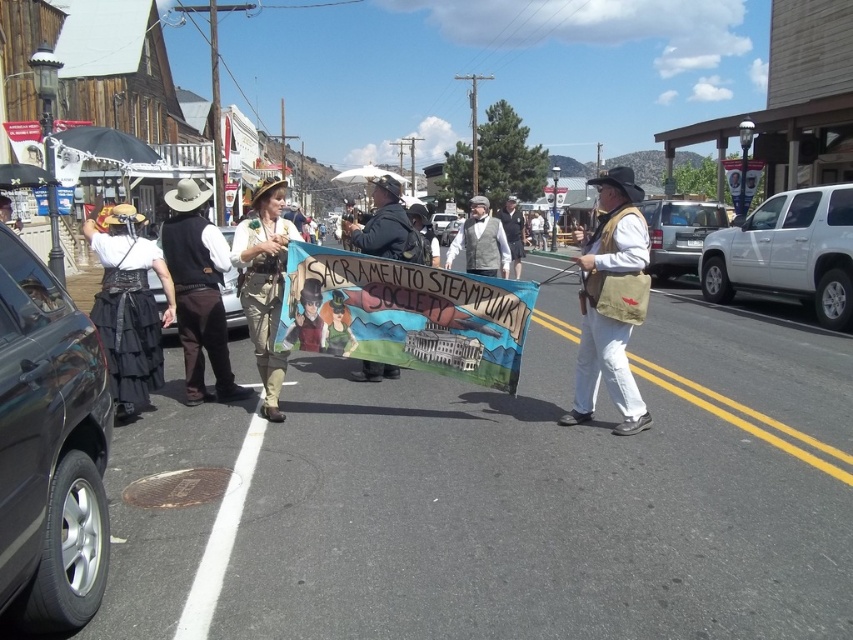
You are standing in the middle of the street at the Sacramento Steampunk Society parade. You want to read the matte black sign at center but are currently 5.83 meters away from it. Is this distance sufficient to read the text on the sign clearly?

The matte black sign at center is 5.83 meters away from viewer. This distance may be sufficient to read the text on the sign clearly, depending on the size of the text and the viewer s visual acuity. However, moving closer could provide a better view for readability.

You are standing at the point closest to the camera in the image. There are two points marked in the scene, one at point (587, 320) and another at point (515, 240). Which point should you move towards if you want to get closer to the camera?

Point (587, 320) is closer to the camera than point (515, 240). Since you are already at the point closest to the camera, you should stay at point (587, 320) to remain closest to the camera.